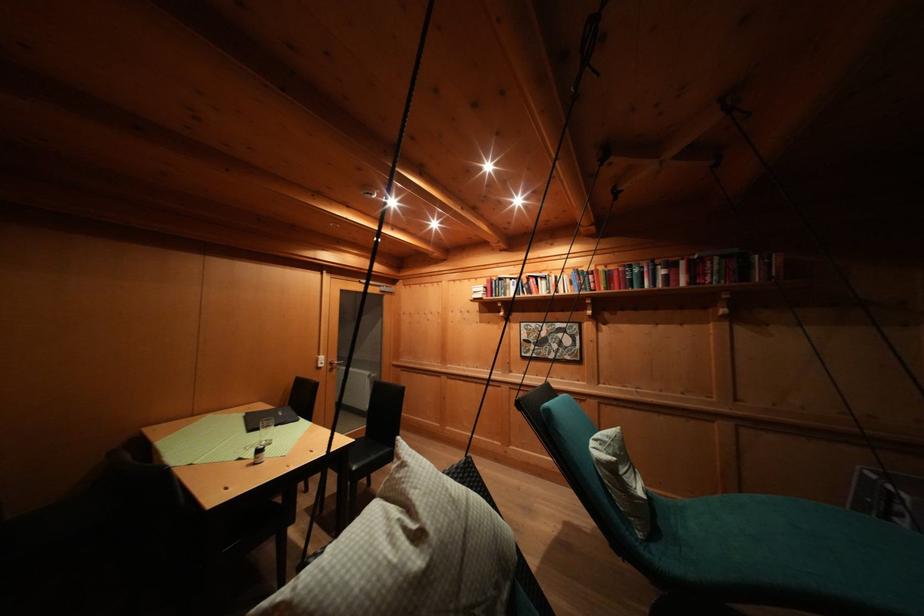
This screenshot has height=616, width=924. What are the coordinates of `chair sitting surface` in the screenshot? It's located at point(369,454).